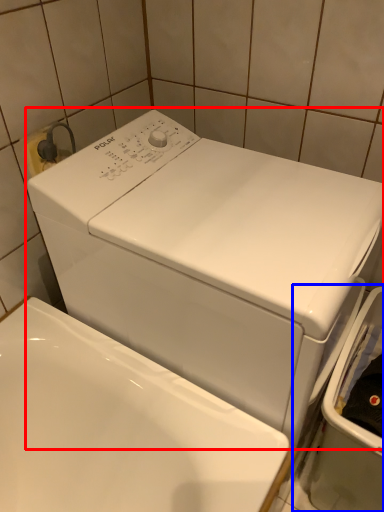
Question: Which point is closer to the camera, washing machine (highlighted by a red box) or dish washer (highlighted by a blue box)?

Choices:
 (A) washing machine
 (B) dish washer

Answer: (A)